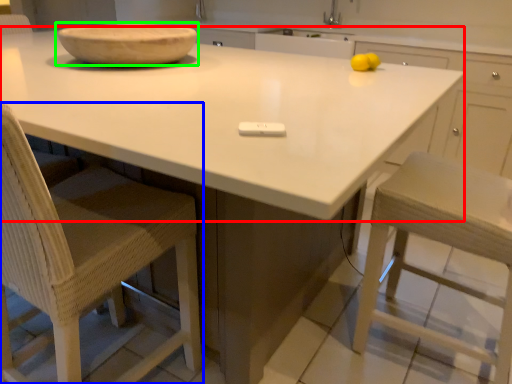
Question: Estimate the real-world distances between objects in this image. Which object is farther from countertop (highlighted by a red box), chair (highlighted by a blue box) or bowl (highlighted by a green box)?

Choices:
 (A) chair
 (B) bowl

Answer: (A)